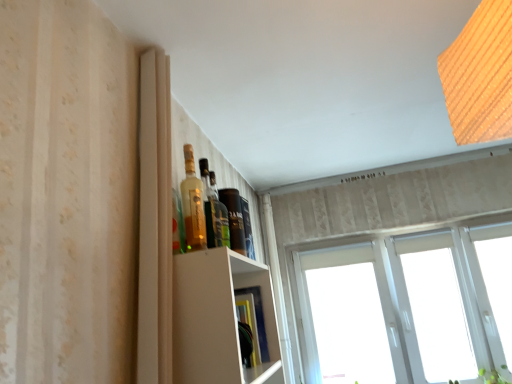
Locate an element on the screen. The width and height of the screenshot is (512, 384). translucent glass bottle at upper center, which is the 1th bottle from front to back is located at coordinates (193, 204).

Locate an element on the screen. This screenshot has width=512, height=384. green leafy plant at lower right is located at coordinates (492, 377).

I want to click on translucent glass bottle at upper center, placed as the 2th bottle when sorted from back to front, so (193, 204).

Does green leafy plant at lower right have a lesser height compared to white plastic window at upper right?

Correct, green leafy plant at lower right is not as tall as white plastic window at upper right.

Could you tell me if green leafy plant at lower right is facing white plastic window at upper right?

Yes, green leafy plant at lower right is facing white plastic window at upper right.

Is green leafy plant at lower right bigger or smaller than white plastic window at upper right?

Considering their sizes, green leafy plant at lower right takes up less space than white plastic window at upper right.

Is white plastic window at upper right completely or partially inside green leafy plant at lower right?

Definitely not — white plastic window at upper right is not inside green leafy plant at lower right.

In the scene shown: Can we say wooden textured light at upper right lies outside white plastic window at upper right?

Indeed, wooden textured light at upper right is completely outside white plastic window at upper right.

From the image's perspective, which object appears higher, wooden textured light at upper right or white plastic window at upper right?

wooden textured light at upper right is shown above in the image.

From a real-world perspective, does wooden textured light at upper right sit lower than white plastic window at upper right?

No, from a real-world perspective, wooden textured light at upper right is not beneath white plastic window at upper right.

Is wooden textured light at upper right smaller than translucent glass bottle at upper center, which is the first bottle from back to front?

Incorrect, wooden textured light at upper right is not smaller in size than translucent glass bottle at upper center, which is the first bottle from back to front.

From the image's perspective, is wooden textured light at upper right located beneath translucent glass bottle at upper center, which is the first bottle from back to front?

No.

In the scene shown: From their relative heights in the image, would you say wooden textured light at upper right is taller or shorter than translucent glass bottle at upper center, arranged as the second bottle when viewed from the front?

wooden textured light at upper right is taller than translucent glass bottle at upper center, arranged as the second bottle when viewed from the front.

I want to click on window behind the translucent glass bottle at upper center, which is the 1th bottle from front to back, so click(x=440, y=275).

Is translucent glass bottle at upper center, placed as the 2th bottle when sorted from back to front, completely or partially outside of white plastic window at upper right?

translucent glass bottle at upper center, placed as the 2th bottle when sorted from back to front, is positioned outside white plastic window at upper right.

From the image's perspective, is translucent glass bottle at upper center, which is the 1th bottle from front to back, above wooden textured light at upper right?

No.

Is translucent glass bottle at upper center, which is the 1th bottle from front to back, far from wooden textured light at upper right?

No.

Considering the relative positions of translucent glass bottle at upper center, which is the 1th bottle from front to back, and wooden textured light at upper right in the image provided, is translucent glass bottle at upper center, which is the 1th bottle from front to back, to the left of wooden textured light at upper right from the viewer's perspective?

Correct, you'll find translucent glass bottle at upper center, which is the 1th bottle from front to back, to the left of wooden textured light at upper right.

Based on their sizes in the image, would you say translucent glass bottle at upper center, placed as the 2th bottle when sorted from back to front, is bigger or smaller than wooden textured light at upper right?

translucent glass bottle at upper center, placed as the 2th bottle when sorted from back to front, is smaller than wooden textured light at upper right.

Is white plastic window at upper right bigger or smaller than translucent glass bottle at upper center, arranged as the second bottle when viewed from the front?

In the image, white plastic window at upper right appears to be larger than translucent glass bottle at upper center, arranged as the second bottle when viewed from the front.

From a real-world perspective, is white plastic window at upper right located beneath translucent glass bottle at upper center, which is the first bottle from back to front?

Yes, from a real-world perspective, white plastic window at upper right is beneath translucent glass bottle at upper center, which is the first bottle from back to front.

Consider the image. Is white plastic window at upper right located outside translucent glass bottle at upper center, arranged as the second bottle when viewed from the front?

Yes, white plastic window at upper right is not within translucent glass bottle at upper center, arranged as the second bottle when viewed from the front.

Visually, is white plastic window at upper right positioned to the left or to the right of translucent glass bottle at upper center, arranged as the second bottle when viewed from the front?

Clearly, white plastic window at upper right is on the right of translucent glass bottle at upper center, arranged as the second bottle when viewed from the front, in the image.

How many degrees apart are the facing directions of white plastic window at upper right and translucent glass bottle at upper center, which is the 1th bottle from front to back?

The angular difference between white plastic window at upper right and translucent glass bottle at upper center, which is the 1th bottle from front to back, is 88.7 degrees.

Is white plastic window at upper right to the left or to the right of translucent glass bottle at upper center, which is the 1th bottle from front to back, in the image?

Based on their positions, white plastic window at upper right is located to the right of translucent glass bottle at upper center, which is the 1th bottle from front to back.

Is white plastic window at upper right next to translucent glass bottle at upper center, which is the 1th bottle from front to back?

white plastic window at upper right is not next to translucent glass bottle at upper center, which is the 1th bottle from front to back, and they're not touching.

Identify the location of the 2nd bottle in front when counting from the white plastic window at upper right. (193, 204).

Where is `window that appears behind the green leafy plant at lower right`? window that appears behind the green leafy plant at lower right is located at coordinates (440, 275).

Locate an element on the screen. This screenshot has height=384, width=512. light located above the white plastic window at upper right (from the image's perspective) is located at coordinates (480, 75).

When comparing their distances from translucent glass bottle at upper center, which is the first bottle from back to front, does wooden textured light at upper right or green leafy plant at lower right seem further?

green leafy plant at lower right is positioned further to the anchor translucent glass bottle at upper center, which is the first bottle from back to front.

Which object lies further to the anchor point wooden textured light at upper right, translucent glass bottle at upper center, placed as the 2th bottle when sorted from back to front, or green leafy plant at lower right?

green leafy plant at lower right.

From the image, which object appears to be farther from white plastic window at upper right, green leafy plant at lower right or wooden textured light at upper right?

The object further to white plastic window at upper right is wooden textured light at upper right.

When comparing their distances from translucent glass bottle at upper center, arranged as the second bottle when viewed from the front, does green leafy plant at lower right or white plastic window at upper right seem further?

green leafy plant at lower right.

From the image, which object appears to be farther from translucent glass bottle at upper center, which is the first bottle from back to front, wooden textured light at upper right or translucent glass bottle at upper center, placed as the 2th bottle when sorted from back to front?

wooden textured light at upper right.

From the image, which object appears to be farther from translucent glass bottle at upper center, arranged as the second bottle when viewed from the front, wooden textured light at upper right or white plastic window at upper right?

The object further to translucent glass bottle at upper center, arranged as the second bottle when viewed from the front, is white plastic window at upper right.

Based on their spatial positions, is wooden textured light at upper right or white plastic window at upper right closer to green leafy plant at lower right?

white plastic window at upper right.

From the image, which object appears to be farther from white plastic window at upper right, wooden textured light at upper right or translucent glass bottle at upper center, which is the first bottle from back to front?

Based on the image, wooden textured light at upper right appears to be further to white plastic window at upper right.

This screenshot has width=512, height=384. In order to click on window between translucent glass bottle at upper center, placed as the 2th bottle when sorted from back to front, and green leafy plant at lower right in this screenshot , I will do `click(440, 275)`.

The height and width of the screenshot is (384, 512). Find the location of `bottle between translucent glass bottle at upper center, which is the 1th bottle from front to back, and white plastic window at upper right in the front-back direction`. bottle between translucent glass bottle at upper center, which is the 1th bottle from front to back, and white plastic window at upper right in the front-back direction is located at coordinates (214, 212).

The height and width of the screenshot is (384, 512). Find the location of `plant between wooden textured light at upper right and white plastic window at upper right along the z-axis`. plant between wooden textured light at upper right and white plastic window at upper right along the z-axis is located at coordinates (492, 377).

Where is `window between translucent glass bottle at upper center, arranged as the second bottle when viewed from the front, and green leafy plant at lower right, in the horizontal direction`? This screenshot has height=384, width=512. window between translucent glass bottle at upper center, arranged as the second bottle when viewed from the front, and green leafy plant at lower right, in the horizontal direction is located at coordinates (440, 275).